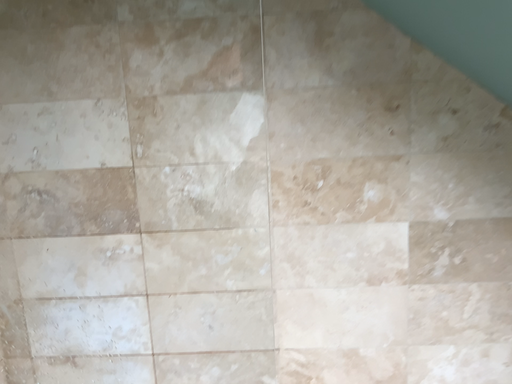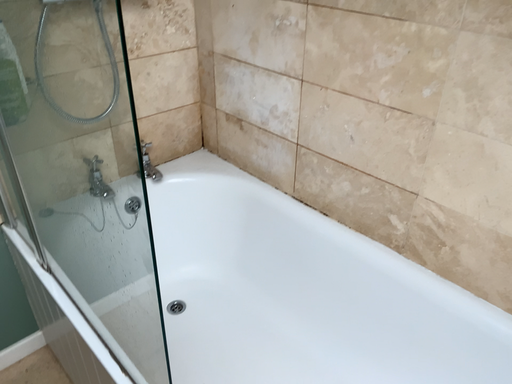
Question: Which way did the camera rotate in the video?

Choices:
 (A) rotated left
 (B) rotated right

Answer: (A)